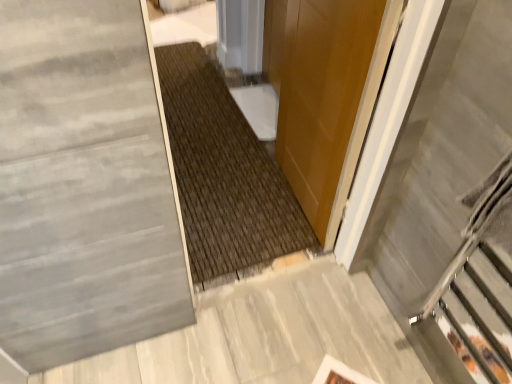
Question: From the image's perspective, is gray polished concrete at lower left located beneath metallic gray escalator at right?

Choices:
 (A) yes
 (B) no

Answer: (A)

Question: Is gray polished concrete at lower left taller than metallic gray escalator at right?

Choices:
 (A) yes
 (B) no

Answer: (B)

Question: Is gray polished concrete at lower left behind metallic gray escalator at right?

Choices:
 (A) yes
 (B) no

Answer: (A)

Question: Are gray polished concrete at lower left and metallic gray escalator at right located far from each other?

Choices:
 (A) no
 (B) yes

Answer: (A)

Question: Is gray polished concrete at lower left facing towards metallic gray escalator at right?

Choices:
 (A) no
 (B) yes

Answer: (A)

Question: In the image, is gray polished concrete at lower left on the left side or the right side of glossy wood door at center?

Choices:
 (A) left
 (B) right

Answer: (A)

Question: From a real-world perspective, is gray polished concrete at lower left physically located above or below glossy wood door at center?

Choices:
 (A) below
 (B) above

Answer: (A)

Question: Is gray polished concrete at lower left inside the boundaries of glossy wood door at center, or outside?

Choices:
 (A) inside
 (B) outside

Answer: (B)

Question: From the image's perspective, relative to glossy wood door at center, is gray polished concrete at lower left above or below?

Choices:
 (A) below
 (B) above

Answer: (A)

Question: From their relative heights in the image, would you say metallic gray escalator at right is taller or shorter than gray polished concrete at lower left?

Choices:
 (A) short
 (B) tall

Answer: (B)

Question: Looking at their shapes, would you say metallic gray escalator at right is wider or thinner than gray polished concrete at lower left?

Choices:
 (A) thin
 (B) wide

Answer: (A)

Question: Based on their positions, is metallic gray escalator at right located to the left or right of gray polished concrete at lower left?

Choices:
 (A) right
 (B) left

Answer: (A)

Question: Is metallic gray escalator at right in front of or behind gray polished concrete at lower left in the image?

Choices:
 (A) front
 (B) behind

Answer: (A)

Question: Considering the positions of glossy wood door at center and gray polished concrete at lower left in the image, is glossy wood door at center bigger or smaller than gray polished concrete at lower left?

Choices:
 (A) big
 (B) small

Answer: (A)

Question: In terms of width, does glossy wood door at center look wider or thinner when compared to gray polished concrete at lower left?

Choices:
 (A) thin
 (B) wide

Answer: (A)